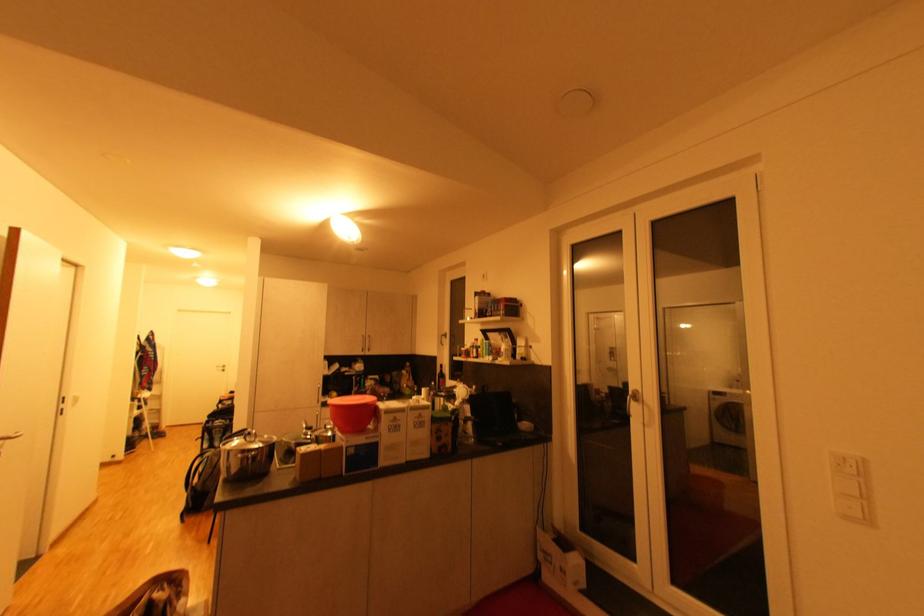
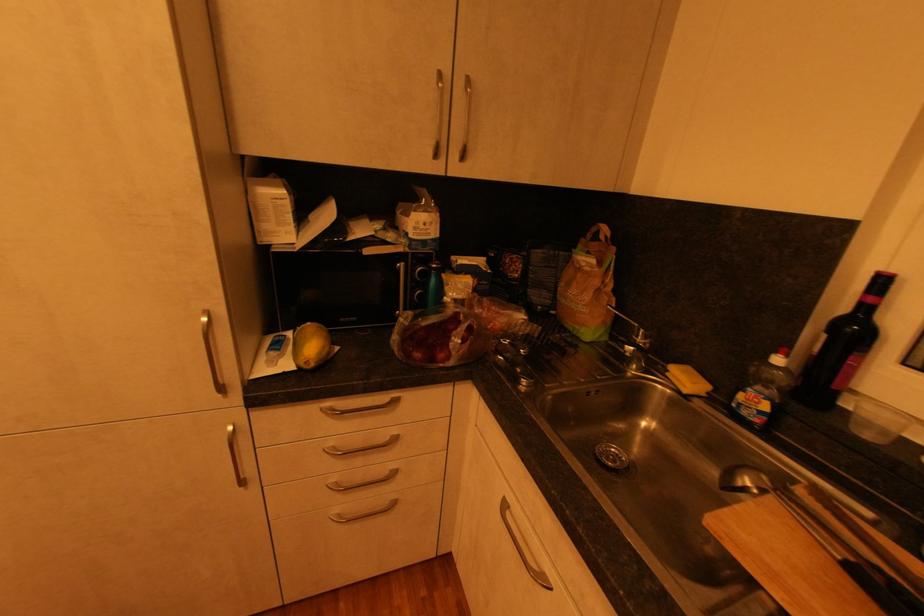
The point at (445, 367) is marked in the first image. Where is the corresponding point in the second image?

(889, 282)